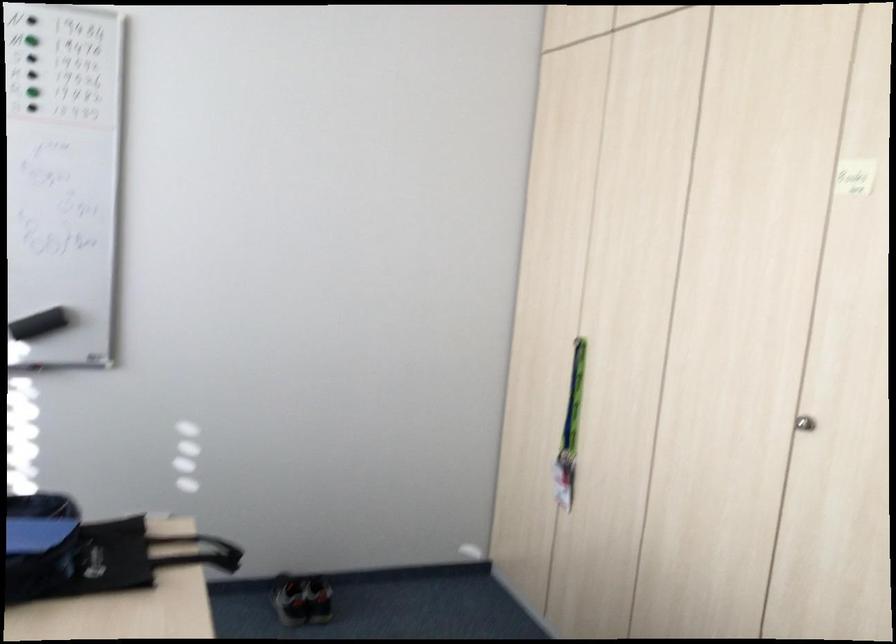
Where would you lift the black whiteboard eraser? Please return your answer as a coordinate pair (x, y).

(39, 324)